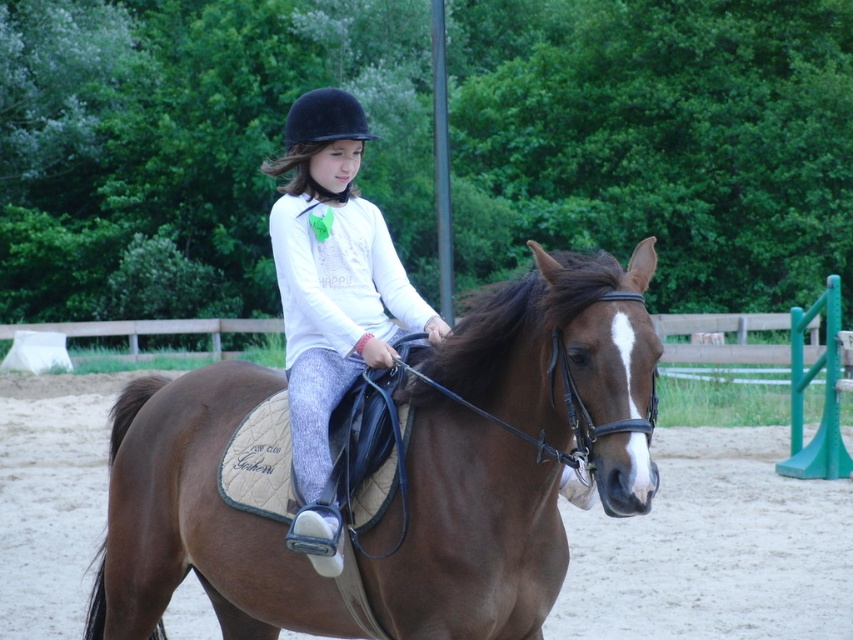
Question: Among these points, which one is farthest from the camera?

Choices:
 (A) (548, 388)
 (B) (325, 113)

Answer: (B)

Question: Does brown leather saddle at center appear on the right side of black velvet helmet at center?

Choices:
 (A) yes
 (B) no

Answer: (A)

Question: Which object appears farthest from the camera in this image?

Choices:
 (A) brown leather saddle at center
 (B) white matte shirt at center

Answer: (B)

Question: Can you confirm if brown leather saddle at center is thinner than white matte shirt at center?

Choices:
 (A) yes
 (B) no

Answer: (A)

Question: Is white matte shirt at center to the left of black velvet helmet at center from the viewer's perspective?

Choices:
 (A) yes
 (B) no

Answer: (B)

Question: Which is nearer to the white matte shirt at center?

Choices:
 (A) brown leather saddle at center
 (B) black velvet helmet at center

Answer: (B)